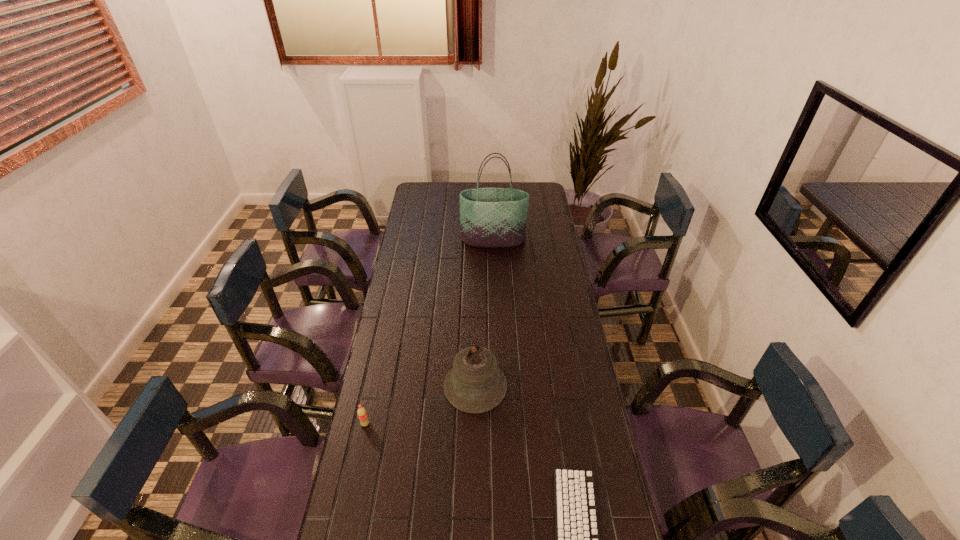
Identify which object is located as the second nearest to the third nearest object. Please provide its 2D coordinates. Your answer should be formatted as a tuple, i.e. [(x, y)], where the tuple contains the x and y coordinates of a point satisfying the conditions above.

[(362, 414)]

You are a GUI agent. You are given a task and a screenshot of the screen. Output one action in this format:
    pyautogui.click(x=<x>, y=<y>)
    Task: Click on the free region that satisfies the following two spatial constraints: 1. on the back side of the tote bag; 2. on the left side of the second tallest object
    The width and height of the screenshot is (960, 540).
    Given the screenshot: What is the action you would take?
    pyautogui.click(x=477, y=240)

Where is `vacant position in the image that satisfies the following two spatial constraints: 1. on the back side of the bell; 2. on the right side of the leftmost object`? vacant position in the image that satisfies the following two spatial constraints: 1. on the back side of the bell; 2. on the right side of the leftmost object is located at coordinates pos(373,386).